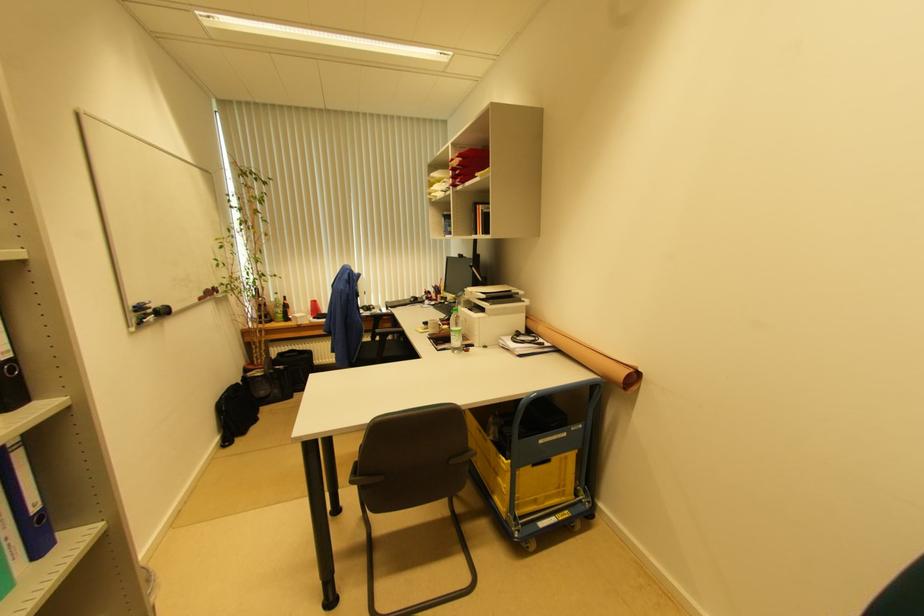
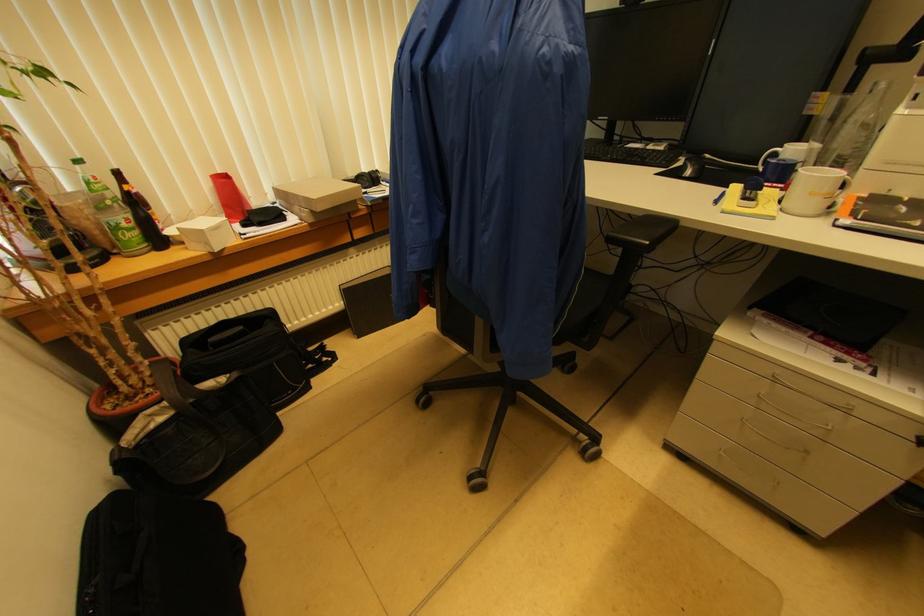
Where in the second image is the point corresponding to (x=265, y=374) from the first image?

(175, 408)